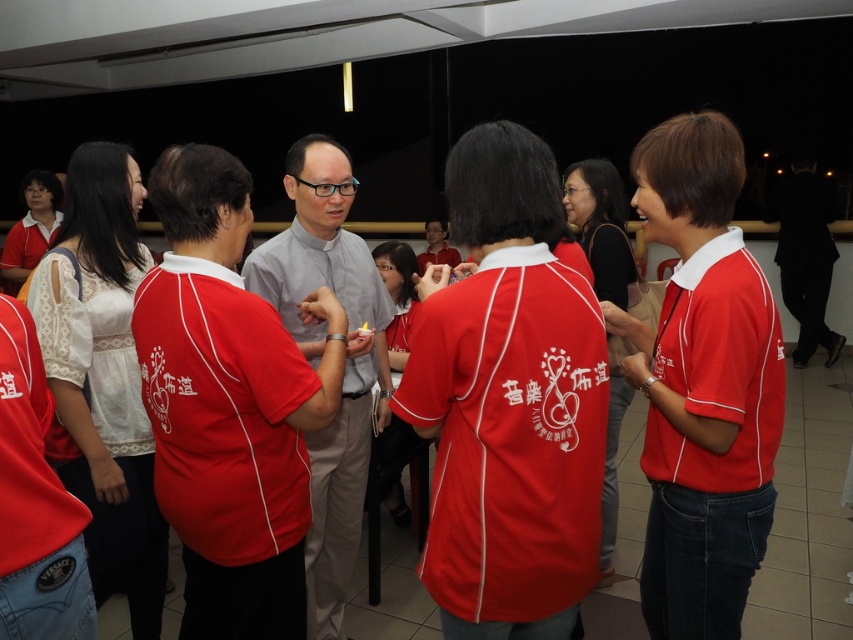
Question: Where is light gray fabric shirt at center located in relation to light gray shirt at center in the image?

Choices:
 (A) above
 (B) below

Answer: (A)

Question: Which of the following is the farthest from the observer?

Choices:
 (A) tap(202, 300)
 (B) tap(280, 280)

Answer: (B)

Question: Considering the relative positions of light gray fabric shirt at center and light gray shirt at center in the image provided, where is light gray fabric shirt at center located with respect to light gray shirt at center?

Choices:
 (A) right
 (B) left

Answer: (B)

Question: Which point is farther to the camera?

Choices:
 (A) (282, 307)
 (B) (252, 372)

Answer: (A)

Question: Which of the following is the closest to the observer?

Choices:
 (A) light gray fabric shirt at center
 (B) light gray shirt at center

Answer: (A)

Question: Does light gray fabric shirt at center have a greater width compared to light gray shirt at center?

Choices:
 (A) no
 (B) yes

Answer: (B)